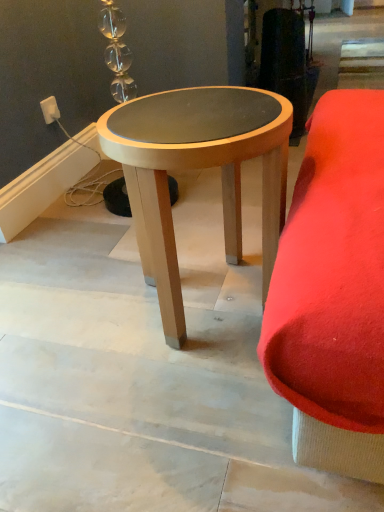
Question: Does white plastic outlet at upper left come in front of light wood/woodenobject at center?

Choices:
 (A) yes
 (B) no

Answer: (B)

Question: Could you tell me if white plastic outlet at upper left is facing light wood/woodenobject at center?

Choices:
 (A) yes
 (B) no

Answer: (B)

Question: Is white plastic outlet at upper left turned away from light wood/woodenobject at center?

Choices:
 (A) yes
 (B) no

Answer: (B)

Question: From a real-world perspective, is white plastic outlet at upper left positioned over light wood/woodenobject at center based on gravity?

Choices:
 (A) yes
 (B) no

Answer: (A)

Question: Is there a large distance between white plastic outlet at upper left and light wood/woodenobject at center?

Choices:
 (A) no
 (B) yes

Answer: (A)

Question: Does white plastic outlet at upper left appear on the right side of light wood/woodenobject at center?

Choices:
 (A) yes
 (B) no

Answer: (B)

Question: Is light wood/woodenobject at center turned away from white plastic outlet at upper left?

Choices:
 (A) yes
 (B) no

Answer: (B)

Question: Does light wood/woodenobject at center have a lesser height compared to white plastic outlet at upper left?

Choices:
 (A) yes
 (B) no

Answer: (B)

Question: Is light wood/woodenobject at center taller than white plastic outlet at upper left?

Choices:
 (A) no
 (B) yes

Answer: (B)

Question: Is light wood/woodenobject at center wider than white plastic outlet at upper left?

Choices:
 (A) yes
 (B) no

Answer: (A)

Question: Does light wood/woodenobject at center lie in front of white plastic outlet at upper left?

Choices:
 (A) no
 (B) yes

Answer: (B)

Question: From the image's perspective, is light wood/woodenobject at center over white plastic outlet at upper left?

Choices:
 (A) no
 (B) yes

Answer: (A)

Question: Is white plastic outlet at upper left wider or thinner than light wood/woodenobject at center?

Choices:
 (A) thin
 (B) wide

Answer: (A)